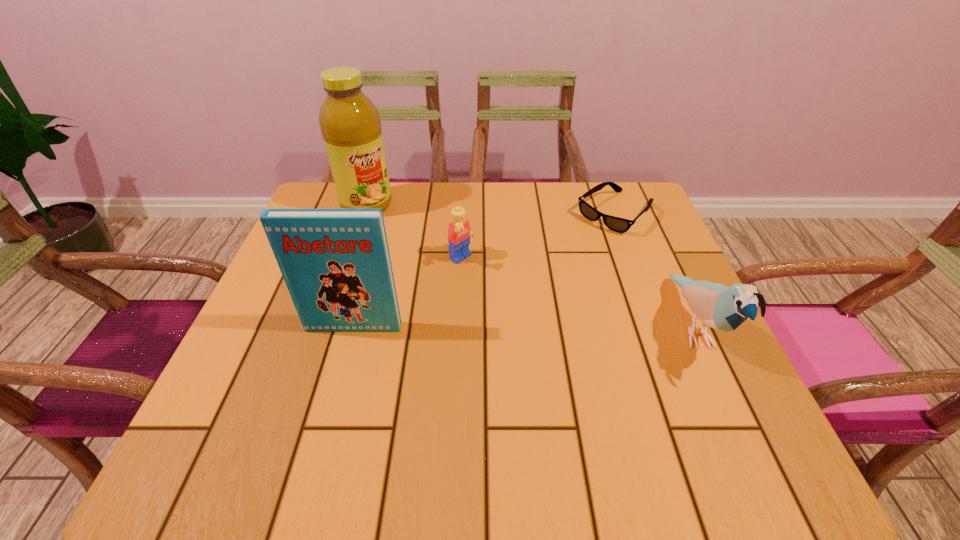
You are a GUI agent. You are given a task and a screenshot of the screen. Output one action in this format:
    pyautogui.click(x=<x>, y=<y>)
    Task: Click on the vacant region at the far right corner
    Image resolution: width=960 pixels, height=540 pixels.
    Given the screenshot: What is the action you would take?
    pyautogui.click(x=599, y=227)

Where is `free space between the fourth shortest object and the bird`? free space between the fourth shortest object and the bird is located at coordinates (523, 327).

Locate an element on the screen. free space that is in between the third tallest object and the fruit juice is located at coordinates (530, 266).

In order to click on vacant region between the book and the sunglasses in this screenshot , I will do `click(485, 270)`.

Identify the location of vacant region between the third shortest object and the second tallest object. (523, 327).

You are a GUI agent. You are given a task and a screenshot of the screen. Output one action in this format:
    pyautogui.click(x=<x>, y=<y>)
    Task: Click on the vacant area between the bird and the third object from right to left
    
    Given the screenshot: What is the action you would take?
    pyautogui.click(x=577, y=293)

The image size is (960, 540). I want to click on free space that is in between the third nearest object and the tallest object, so click(x=415, y=232).

At what (x,y) coordinates should I click in order to perform the action: click on free space between the book and the Lego. Please return your answer as a coordinate pair (x, y). The height and width of the screenshot is (540, 960). Looking at the image, I should click on (408, 293).

Where is `unoccupied position between the Lego and the bird`? unoccupied position between the Lego and the bird is located at coordinates (577, 293).

Choose which object is the nearest neighbor to the book. Please provide its 2D coordinates. Your answer should be formatted as a tuple, i.e. [(x, y)], where the tuple contains the x and y coordinates of a point satisfying the conditions above.

[(459, 233)]